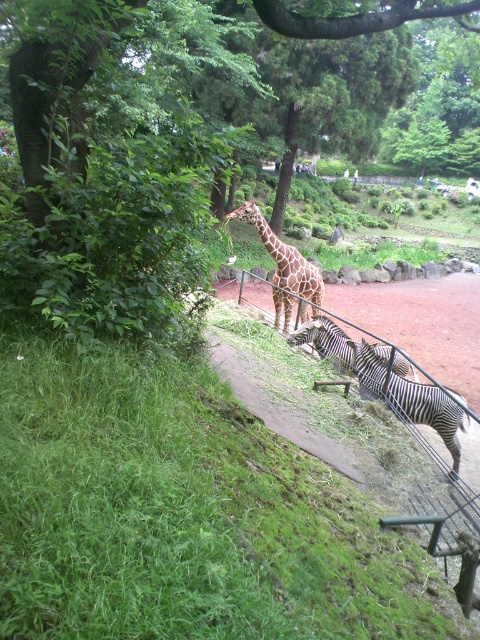
Between point (348, 340) and point (339, 339), which one is positioned behind?

The point (339, 339) is behind.

Is black and white striped zebra at lower right taller than black and white striped zebra at center?

Yes, black and white striped zebra at lower right is taller than black and white striped zebra at center.

Locate an element on the screen. black and white striped zebra at lower right is located at coordinates (411, 400).

Locate an element on the screen. This screenshot has width=480, height=640. black and white striped zebra at lower right is located at coordinates point(411,400).

Can you confirm if black and white striped zebra at lower right is wider than spotted giraffe at center?

Correct, the width of black and white striped zebra at lower right exceeds that of spotted giraffe at center.

Does black and white striped zebra at lower right appear over spotted giraffe at center?

Incorrect, black and white striped zebra at lower right is not positioned above spotted giraffe at center.

Image resolution: width=480 pixels, height=640 pixels. What do you see at coordinates (411, 400) in the screenshot?
I see `black and white striped zebra at lower right` at bounding box center [411, 400].

This screenshot has width=480, height=640. In order to click on black and white striped zebra at lower right in this screenshot , I will do `click(411, 400)`.

Is black and white striped zebra at lower right positioned at the back of white glossy zebra at center?

No, black and white striped zebra at lower right is closer to the viewer.

Is black and white striped zebra at lower right taller than white glossy zebra at center?

No.

Is point (417, 419) farther from viewer compared to point (301, 168)?

No, (417, 419) is in front of (301, 168).

Image resolution: width=480 pixels, height=640 pixels. Find the location of `black and white striped zebra at lower right`. black and white striped zebra at lower right is located at coordinates (411, 400).